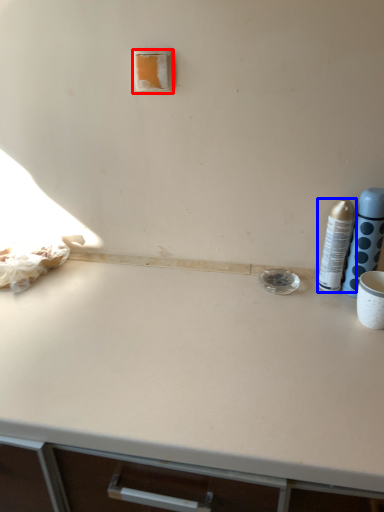
Question: Which of the following is the farthest to the observer, light switch (highlighted by a red box) or bottle (highlighted by a blue box)?

Choices:
 (A) light switch
 (B) bottle

Answer: (A)